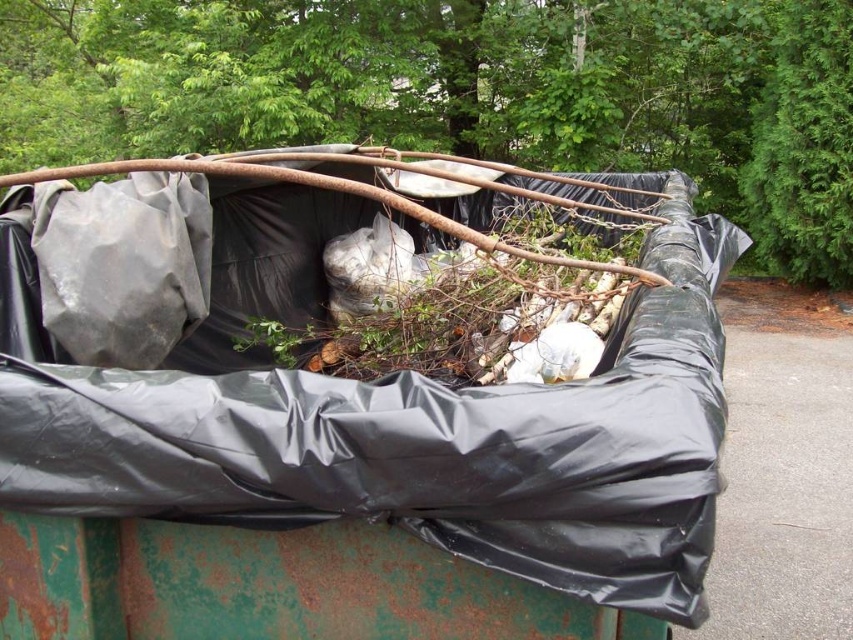
You are standing in a park and see the black plastic bin at center and the rusty metal tree at upper center. Which object is located to the right side of the other?

The black plastic bin at center is to the right of the rusty metal tree at upper center.

You are standing in a park and see a large green dumpster partially covered by a black plastic tarp. The tarp is secured with rusty metal bars and chains. There is a point marked at coordinates (357, 445). What does this point indicate?

The point at coordinates (357, 445) indicates the location of the black plastic bin at center.

You are standing in a park and see the black plastic bin at center and the rusty metal tree at upper center. Which object is closer to you?

The black plastic bin at center is closer to you because it is in front of the rusty metal tree at upper center.